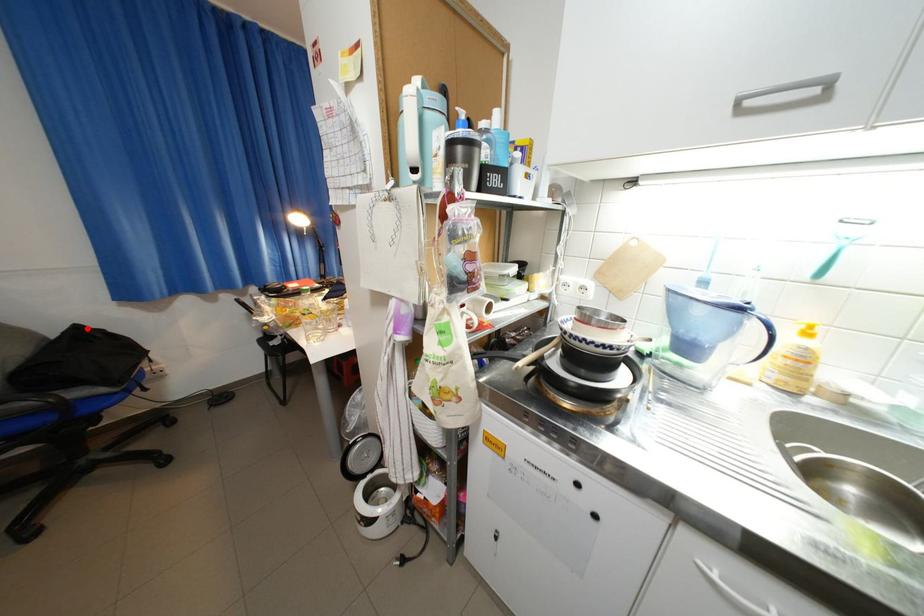
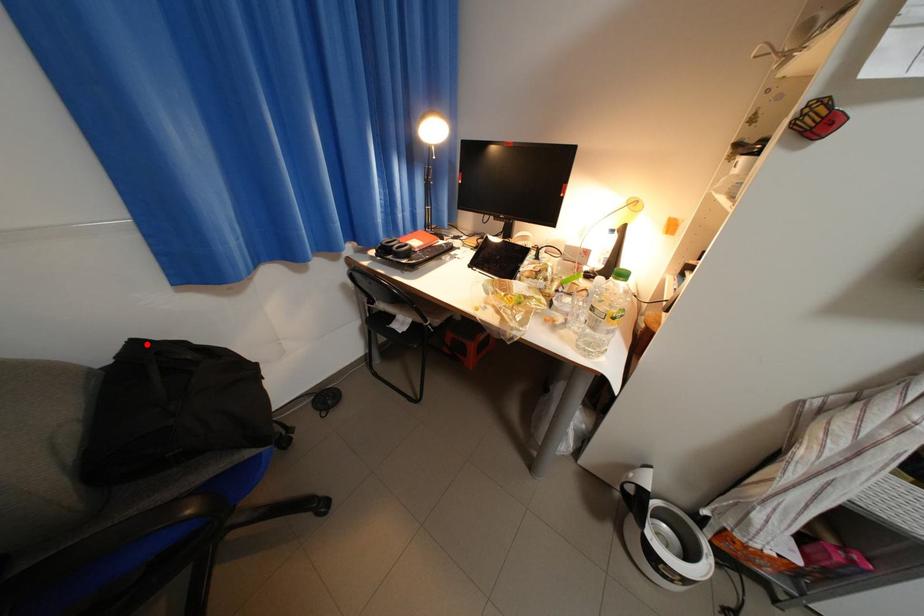
I am providing you with two images of the same scene from different viewpoints. A red point is marked on the first image and another point is marked on the second image. Is the marked point in image1 the same physical position as the marked point in image2?

Yes